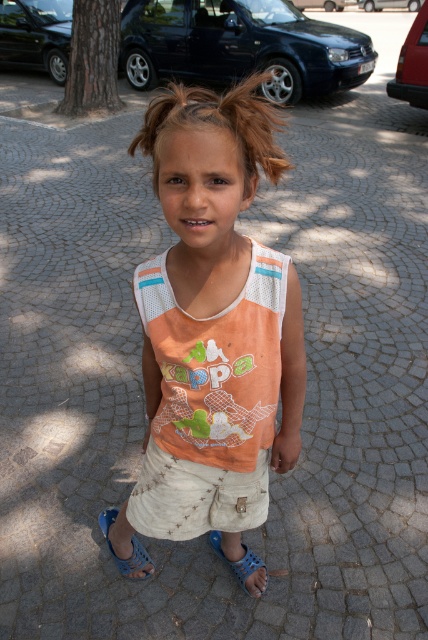
Based on the scene described, which object is wider when comparing the light brown textured hair at center and the blue rubber sandal at lower center?

The light brown textured hair at center is wider than the blue rubber sandal at lower center according to the description.

You are standing in the scene and notice a point marked at coordinates (219,522). If you want to reach that point without moving your feet, can you touch it with your outstretched hand?

The point at (219,522) is 1.78 meters away from the viewer. Since the average human arm length is about 0.7 meters, you cannot reach it with your outstretched hand as the distance is greater than your arm length.

You are standing in the image and want to walk towards the two points marked in the scene. Which point, point (235,561) or point (107,520), would you reach first?

You would reach point (235,561) first because it is closer to you than point (107,520).